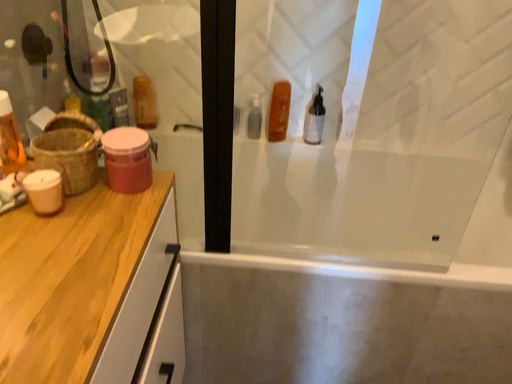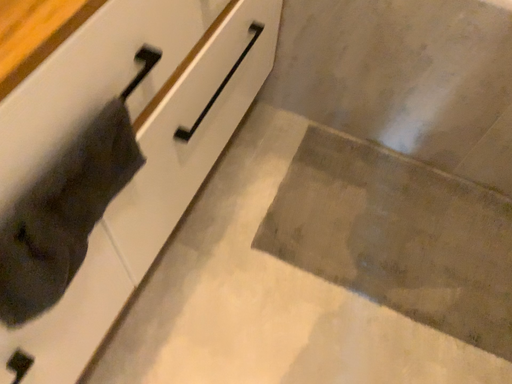
Question: How did the camera likely rotate when shooting the video?

Choices:
 (A) rotated left
 (B) rotated right

Answer: (A)